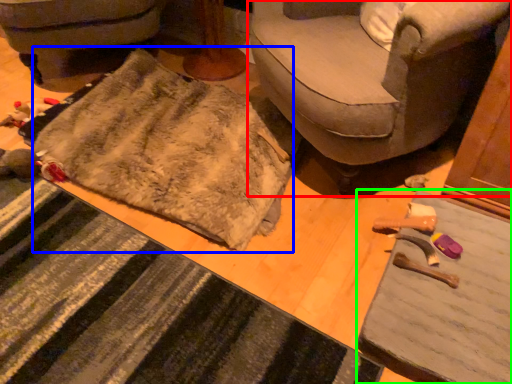
Question: Which object is the farthest from studio couch (highlighted by a red box)? Choose among these: blanket (highlighted by a blue box) or table (highlighted by a green box).

Choices:
 (A) blanket
 (B) table

Answer: (B)